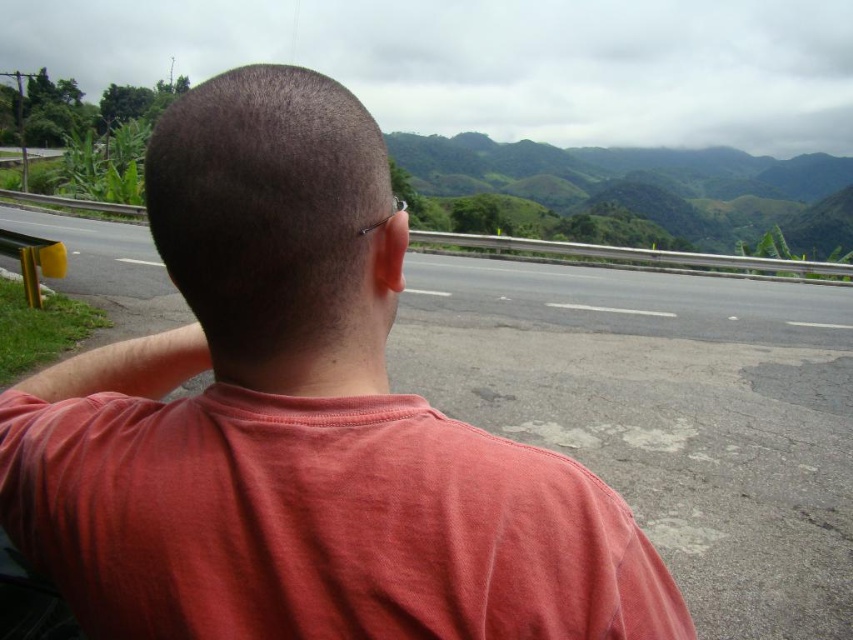
Question: Which of the following is the farthest from the observer?

Choices:
 (A) pink cotton shirt at center
 (B) cotton t-shirt at center
 (C) green grassy hill at upper center
 (D) asphalt road at center

Answer: (C)

Question: Which object appears farthest from the camera in this image?

Choices:
 (A) asphalt road at center
 (B) cotton t-shirt at center

Answer: (A)

Question: Can you confirm if cotton t-shirt at center is positioned to the right of green grassy hill at upper center?

Choices:
 (A) yes
 (B) no

Answer: (B)

Question: Does pink cotton shirt at center appear on the left side of asphalt road at center?

Choices:
 (A) yes
 (B) no

Answer: (B)

Question: Which object appears farthest from the camera in this image?

Choices:
 (A) pink cotton shirt at center
 (B) asphalt road at center

Answer: (B)

Question: Can you confirm if pink cotton shirt at center is positioned below green grassy hill at upper center?

Choices:
 (A) yes
 (B) no

Answer: (A)